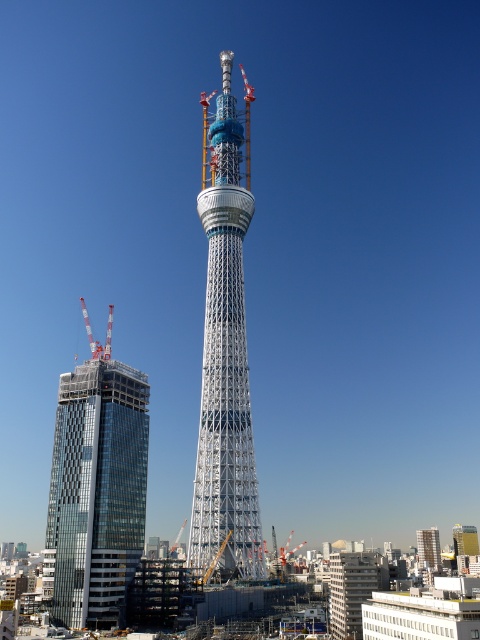
Is metallic silver building at center positioned behind metallic construction crane at left?

Yes, it is behind metallic construction crane at left.

This screenshot has width=480, height=640. Describe the element at coordinates (428, 548) in the screenshot. I see `metallic silver building at center` at that location.

At what (x,y) coordinates should I click in order to perform the action: click on metallic silver building at center. Please return your answer as a coordinate pair (x, y). Looking at the image, I should click on (428, 548).

Is white metallic tower at center thinner than metallic construction crane at left?

Yes, white metallic tower at center is thinner than metallic construction crane at left.

Is point (232, 554) positioned after point (108, 308)?

No, (232, 554) is closer to viewer.

You are a GUI agent. You are given a task and a screenshot of the screen. Output one action in this format:
    pyautogui.click(x=<x>, y=<y>)
    Task: Click on the white metallic tower at center
    This screenshot has width=480, height=640.
    Given the screenshot: What is the action you would take?
    pyautogui.click(x=226, y=349)

Is glassy modern skyscraper at left thinner than metallic construction crane at left?

Yes.

Is point (56, 524) positioned behind point (86, 321)?

That is False.

Find the location of a particular element. This screenshot has height=640, width=480. glassy modern skyscraper at left is located at coordinates (96, 492).